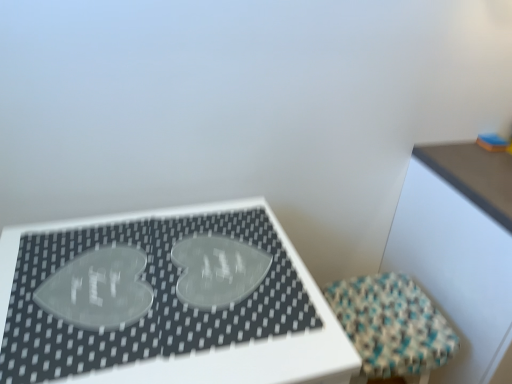
The height and width of the screenshot is (384, 512). What are the coordinates of `free point above transparent pet heart at center, placed as the 1th table when sorted from left to right (from a real-world perspective)` in the screenshot? It's located at (149, 295).